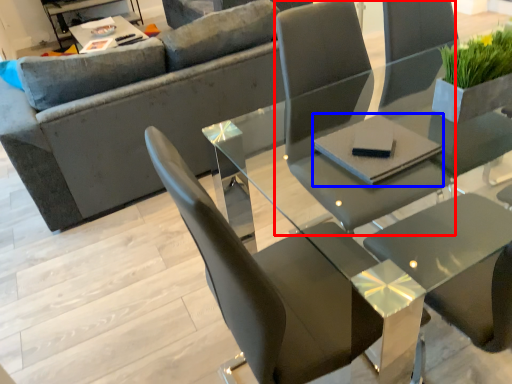
Question: Which object is further to the camera taking this photo, chair (highlighted by a red box) or pad (highlighted by a blue box)?

Choices:
 (A) chair
 (B) pad

Answer: (B)